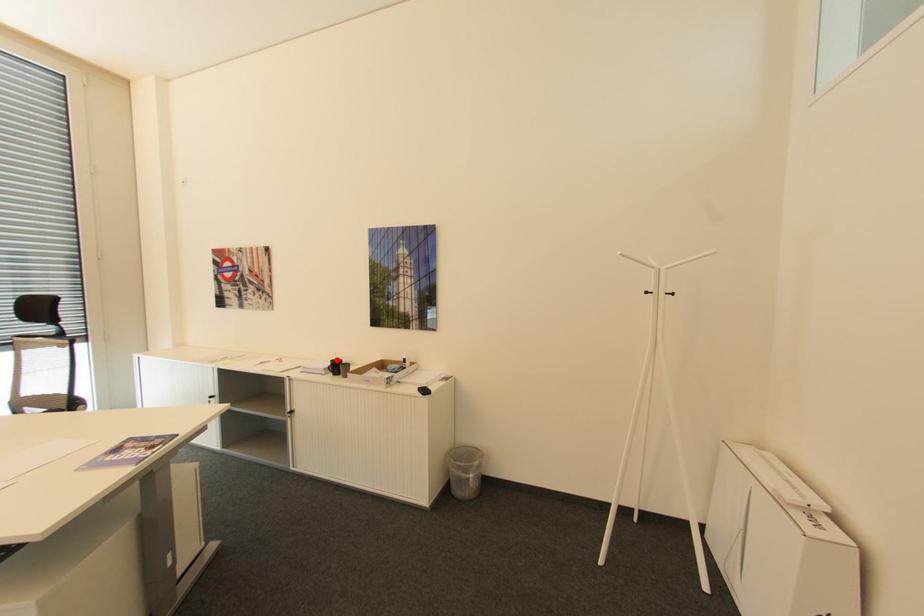
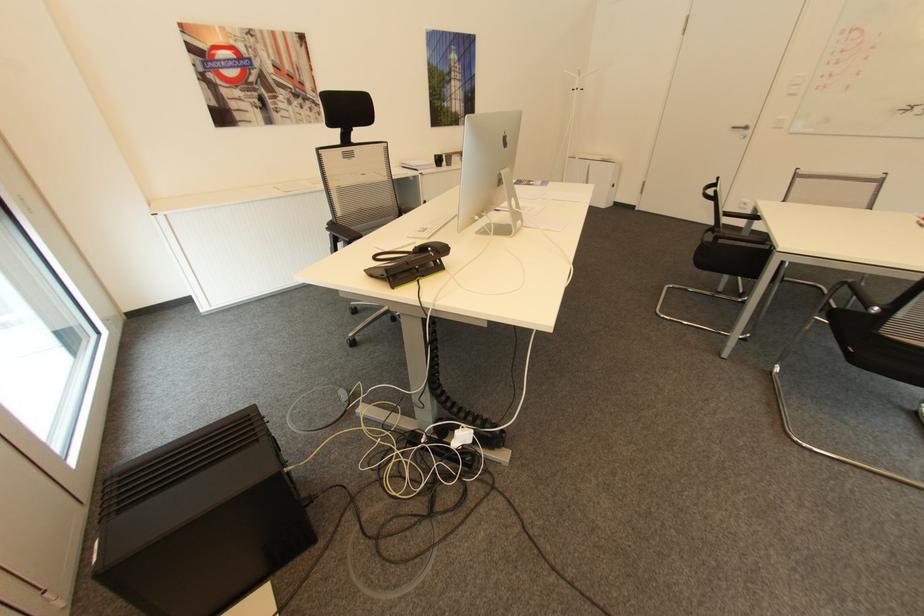
Question: I am providing you with two images of the same scene from different viewpoints. Given a red point in image1, look at the same physical point in image2. Is it:

Choices:
 (A) Closer to the viewpoint
 (B) Farther from the viewpoint

Answer: (A)